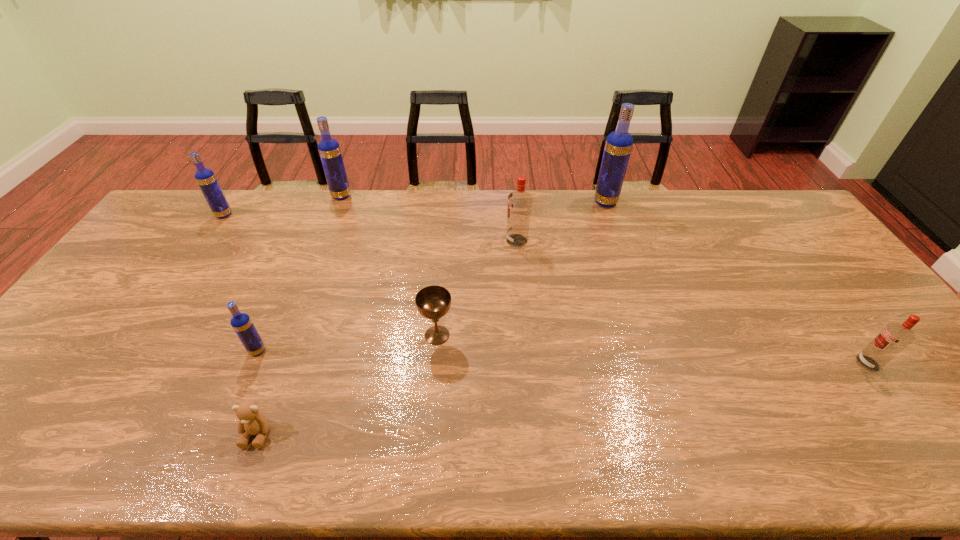
Where is `free space that satisfies the following two spatial constraints: 1. on the front label of the farther red vodka; 2. on the face of the nearest object`? This screenshot has width=960, height=540. free space that satisfies the following two spatial constraints: 1. on the front label of the farther red vodka; 2. on the face of the nearest object is located at coordinates (535, 434).

The image size is (960, 540). I want to click on vacant region that satisfies the following two spatial constraints: 1. on the back side of the chalice; 2. on the right side of the rightmost blue vodka, so click(448, 202).